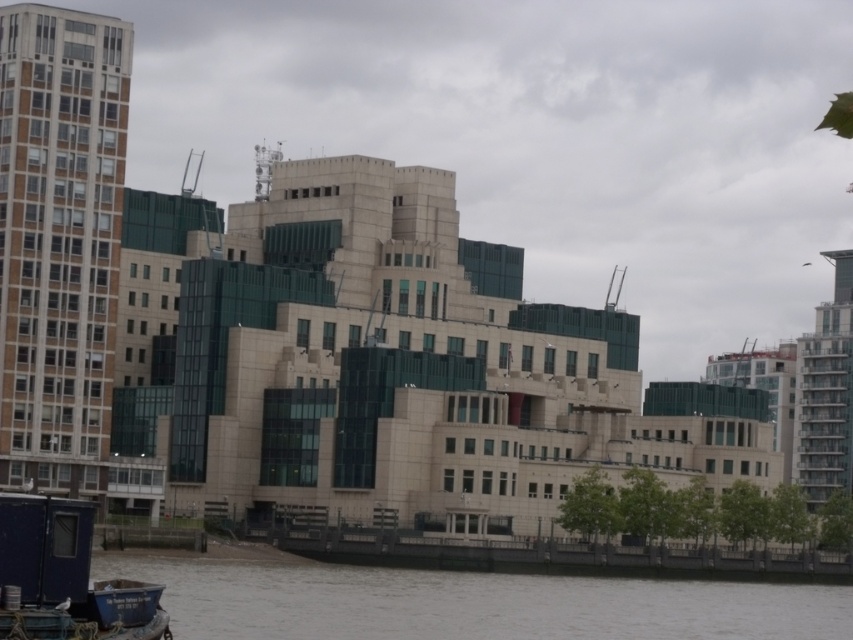
Question: Which point is closer to the camera?

Choices:
 (A) blue painted wood boat at lower left
 (B) brown water at lower left

Answer: (A)

Question: Is brown water at lower left in front of blue painted wood boat at lower left?

Choices:
 (A) no
 (B) yes

Answer: (A)

Question: Is brown water at lower left positioned before blue painted wood boat at lower left?

Choices:
 (A) no
 (B) yes

Answer: (A)

Question: Which of the following is the farthest from the observer?

Choices:
 (A) brown water at lower left
 (B) blue painted wood boat at lower left

Answer: (A)

Question: Is brown water at lower left positioned at the back of blue painted wood boat at lower left?

Choices:
 (A) yes
 (B) no

Answer: (A)